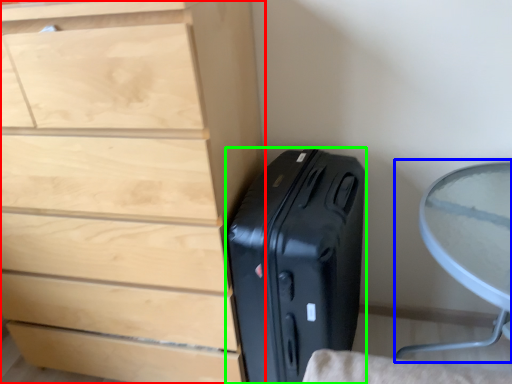
Question: Based on their relative distances, which object is farther from chest of drawers (highlighted by a red box)? Choose from round table (highlighted by a blue box) and suitcase (highlighted by a green box).

Choices:
 (A) round table
 (B) suitcase

Answer: (A)